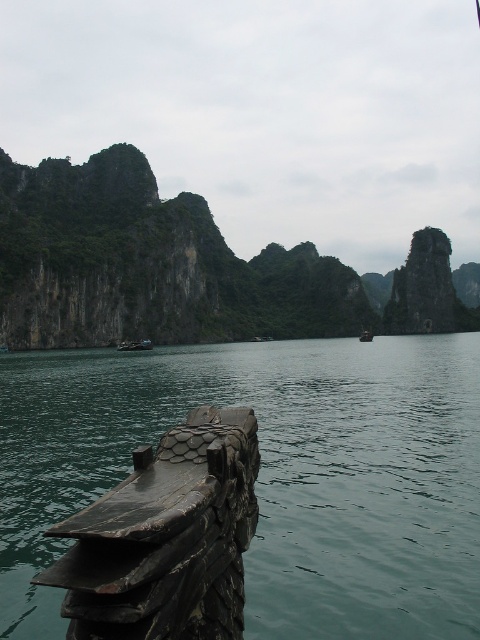
Question: Can you confirm if greenish water at lower left is positioned above dark green wooden boat at center?

Choices:
 (A) no
 (B) yes

Answer: (A)

Question: Does dark green wooden boat at center appear under wooden boat at center?

Choices:
 (A) no
 (B) yes

Answer: (B)

Question: Which of the following is the closest to the observer?

Choices:
 (A) (363, 339)
 (B) (78, 269)
 (C) (121, 349)
 (D) (452, 628)

Answer: (D)

Question: Which point is closer to the camera?

Choices:
 (A) (121, 280)
 (B) (369, 332)

Answer: (A)

Question: Can you confirm if greenish water at lower left is wider than green rock formation at center?

Choices:
 (A) no
 (B) yes

Answer: (A)

Question: Which point is farther to the camera?

Choices:
 (A) (414, 476)
 (B) (369, 333)

Answer: (B)